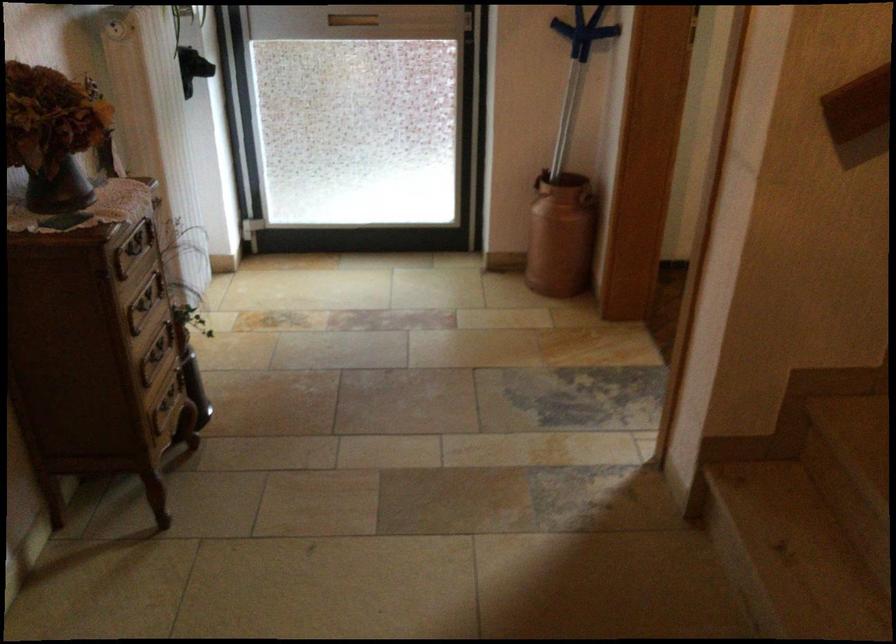
Where is `mail slot`? mail slot is located at coordinates (352, 20).